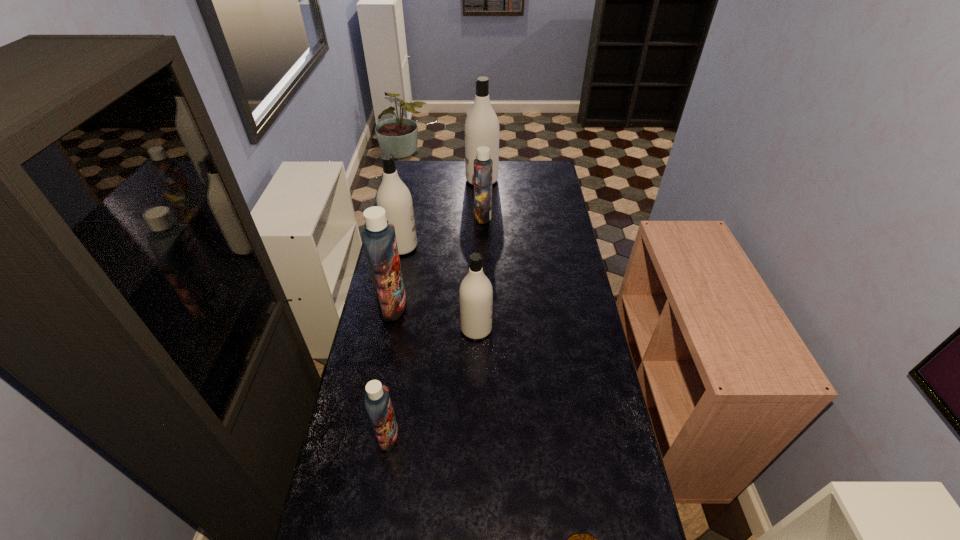
Identify the location of object present at the far edge. Image resolution: width=960 pixels, height=540 pixels. (481, 128).

In the image, there is a desktop. Where is `vacant area at the far edge`? Image resolution: width=960 pixels, height=540 pixels. vacant area at the far edge is located at coordinates (441, 171).

Where is `vacant area at the left edge of the desktop`? vacant area at the left edge of the desktop is located at coordinates (351, 414).

Identify the location of vacant region at the right edge of the desktop. The image size is (960, 540). (541, 243).

At what (x,y) coordinates should I click in order to perform the action: click on free spot between the second nearest blue shampoo and the smallest white shampoo. Please return your answer as a coordinate pair (x, y). Looking at the image, I should click on (435, 318).

Where is `vacant area that lies between the smallest blue shampoo and the biggest blue shampoo`? This screenshot has width=960, height=540. vacant area that lies between the smallest blue shampoo and the biggest blue shampoo is located at coordinates (391, 371).

The image size is (960, 540). Find the location of `empty space that is in between the biggest blue shampoo and the second nearest object`. empty space that is in between the biggest blue shampoo and the second nearest object is located at coordinates (391, 371).

Locate which object ranks third in proximity to the second farthest object. Please provide its 2D coordinates. Your answer should be formatted as a tuple, i.e. [(x, y)], where the tuple contains the x and y coordinates of a point satisfying the conditions above.

[(379, 239)]

Identify which object is located as the sixth nearest to the tallest shampoo. Please provide its 2D coordinates. Your answer should be formatted as a tuple, i.e. [(x, y)], where the tuple contains the x and y coordinates of a point satisfying the conditions above.

[(580, 539)]

Locate which shampoo ranks second in proximity to the second farthest blue shampoo. Please provide its 2D coordinates. Your answer should be formatted as a tuple, i.e. [(x, y)], where the tuple contains the x and y coordinates of a point satisfying the conditions above.

[(476, 293)]